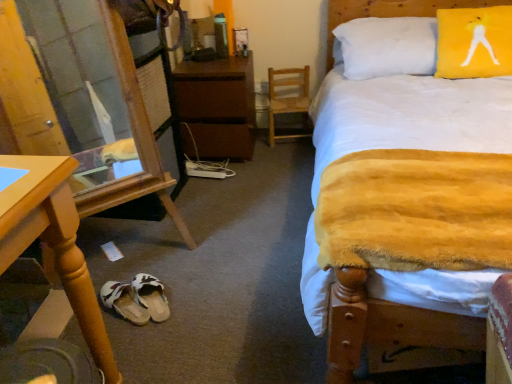
Locate an element on the screen. The width and height of the screenshot is (512, 384). free location to the right of wooden desk at lower left is located at coordinates (144, 344).